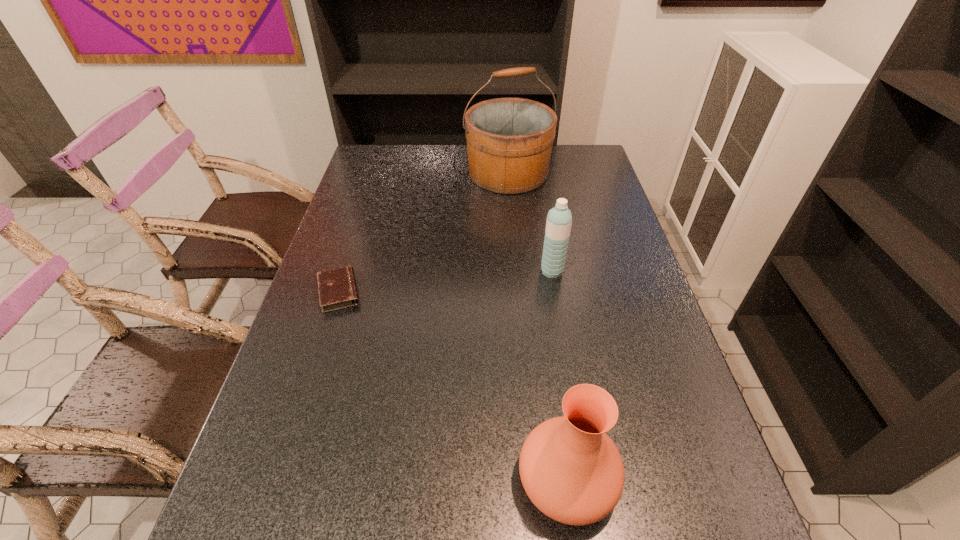
You are a GUI agent. You are given a task and a screenshot of the screen. Output one action in this format:
    pyautogui.click(x=<x>, y=<y>)
    Task: Click on the bucket
    The width and height of the screenshot is (960, 540).
    Given the screenshot: What is the action you would take?
    pyautogui.click(x=509, y=140)

At what (x,y) coordinates should I click in order to perform the action: click on the farthest object. Please return your answer as a coordinate pair (x, y). This screenshot has height=540, width=960. Looking at the image, I should click on (509, 140).

Where is `vase`? vase is located at coordinates (571, 470).

The width and height of the screenshot is (960, 540). In order to click on water bottle in this screenshot , I will do `click(559, 219)`.

Identify the location of the shortest object. (337, 288).

The image size is (960, 540). What are the coordinates of `diary` in the screenshot? It's located at (337, 288).

This screenshot has width=960, height=540. Identify the location of vacant region located on the left of the farthest object. (355, 173).

Locate an element on the screen. free space located 0.150m on the back of the vase is located at coordinates (552, 370).

Find the location of `free space located 0.050m on the right of the water bottle`. free space located 0.050m on the right of the water bottle is located at coordinates (581, 271).

In order to click on vacant area located on the front of the diary in this screenshot , I will do point(316,363).